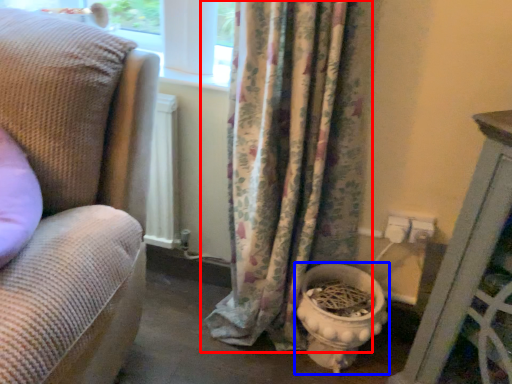
Question: Which object is further to the camera taking this photo, curtain (highlighted by a red box) or toilet bowl (highlighted by a blue box)?

Choices:
 (A) curtain
 (B) toilet bowl

Answer: (B)